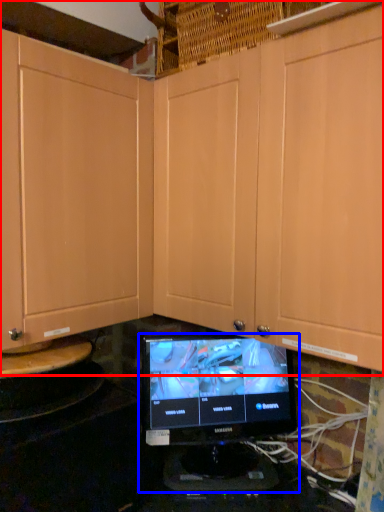
Question: Which point is closer to the camera, cabinetry (highlighted by a red box) or computer monitor (highlighted by a blue box)?

Choices:
 (A) cabinetry
 (B) computer monitor

Answer: (A)